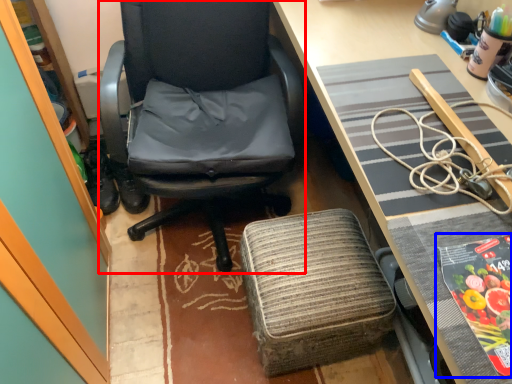
Question: Which object appears farthest to the camera in this image, chair (highlighted by a red box) or paperback book (highlighted by a blue box)?

Choices:
 (A) chair
 (B) paperback book

Answer: (A)